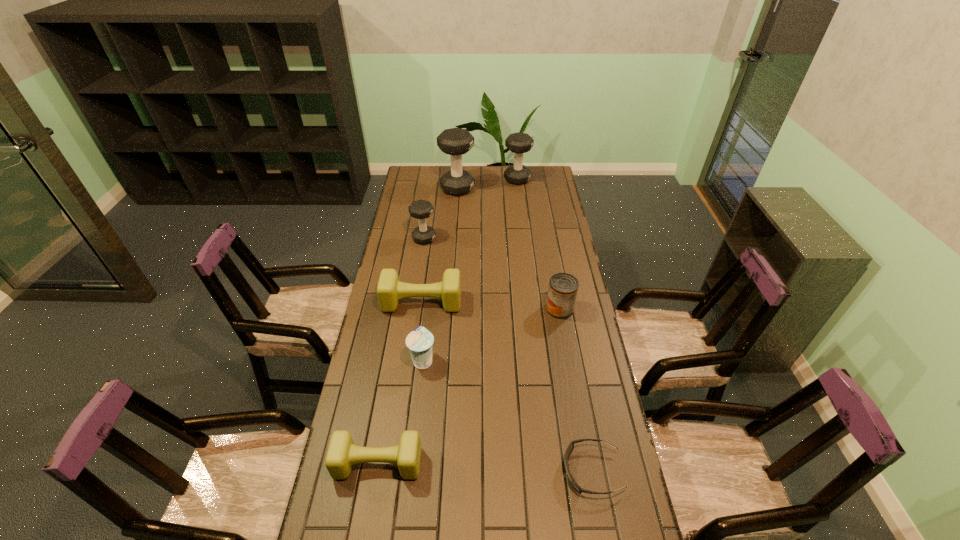
Locate an element on the screen. blue yogurt is located at coordinates (419, 341).

This screenshot has height=540, width=960. Identify the location of the nearer olive dumbbell. (342, 453).

Locate an element on the screen. This screenshot has height=540, width=960. the smaller olive dumbbell is located at coordinates (342, 453).

You are a GUI agent. You are given a task and a screenshot of the screen. Output one action in this format:
    pyautogui.click(x=<x>, y=<y>)
    Task: Click on the black goggles
    Image resolution: width=960 pixels, height=540 pixels.
    Given the screenshot: What is the action you would take?
    pyautogui.click(x=570, y=447)

This screenshot has width=960, height=540. I want to click on goggles, so click(570, 447).

Locate an element on the screen. The width and height of the screenshot is (960, 540). free space located on the left of the biggest gray dumbbell is located at coordinates (419, 188).

Identify the location of vacant space located 0.200m on the left of the rightmost gray dumbbell. This screenshot has height=540, width=960. (467, 179).

At what (x,y) coordinates should I click in order to perform the action: click on vacant position located on the front of the third shortest dumbbell. Please return your answer as a coordinate pair (x, y). Looking at the image, I should click on (417, 292).

You are a GUI agent. You are given a task and a screenshot of the screen. Output one action in this format:
    pyautogui.click(x=<x>, y=<y>)
    Task: Click on the free region located 0.200m on the left of the red can
    This screenshot has width=960, height=540.
    Given the screenshot: What is the action you would take?
    pyautogui.click(x=493, y=309)

Where is `vacant region located on the right of the fourth farthest dumbbell`? The width and height of the screenshot is (960, 540). vacant region located on the right of the fourth farthest dumbbell is located at coordinates (513, 302).